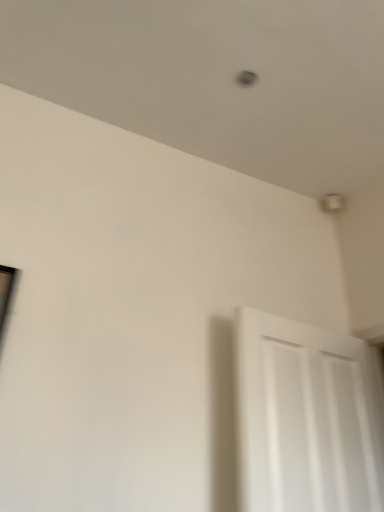
What do you see at coordinates (304, 419) in the screenshot? I see `white matte door at lower right` at bounding box center [304, 419].

What is the approximate width of white matte door at lower right?

4.83 inches.

What is the approximate height of white matte door at lower right?

29.74 inches.

The image size is (384, 512). Identify the location of white matte door at lower right. (304, 419).

Where is `white matte door at lower right`? The width and height of the screenshot is (384, 512). white matte door at lower right is located at coordinates (304, 419).